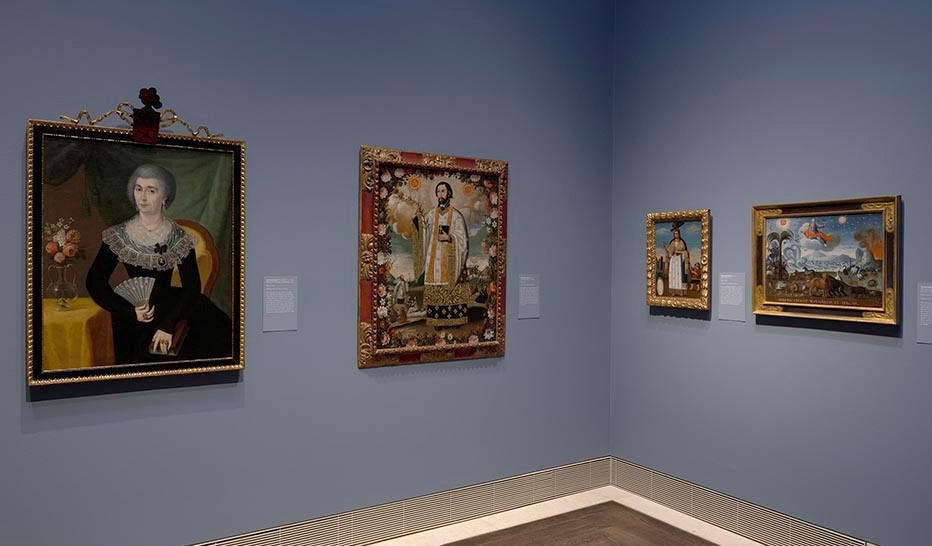
Image resolution: width=932 pixels, height=546 pixels. Find the location of `yellow tablecloth`. yellow tablecloth is located at coordinates (60, 345).